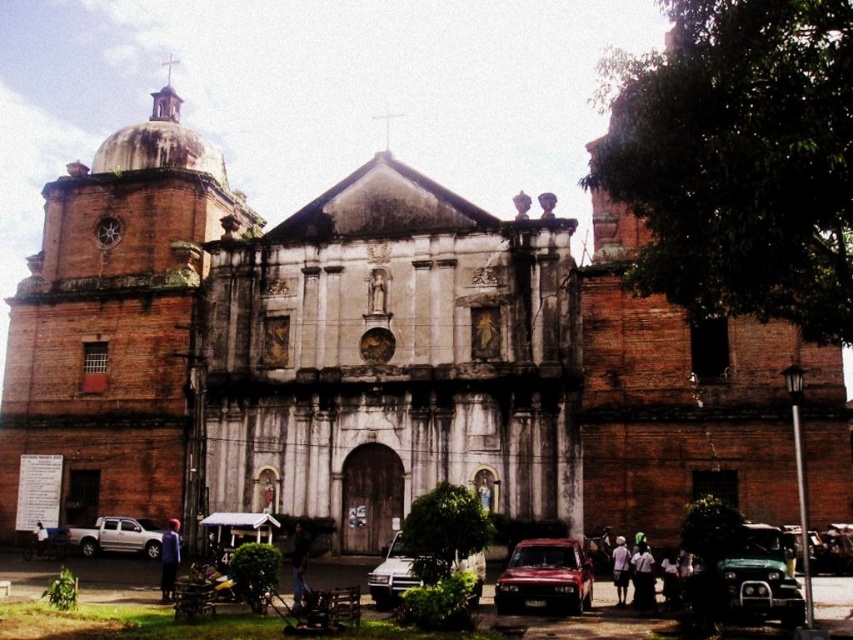
You are standing in front of the historic church and notice a silver metallic pickup truck at lower left and a dark blue uniform at lower center. Which object is positioned more to the left side of the scene?

The silver metallic pickup truck at lower left is positioned more to the left side of the scene than the dark blue uniform at lower center.

You are standing in a parking lot near the historic church. You see a silver metallic pickup truck at lower left. If you want to get to the truck quickly, should you walk towards the church or away from it?

The silver metallic pickup truck at lower left is 76.93 meters away from viewer, so you should walk away from the church to reach it quickly.